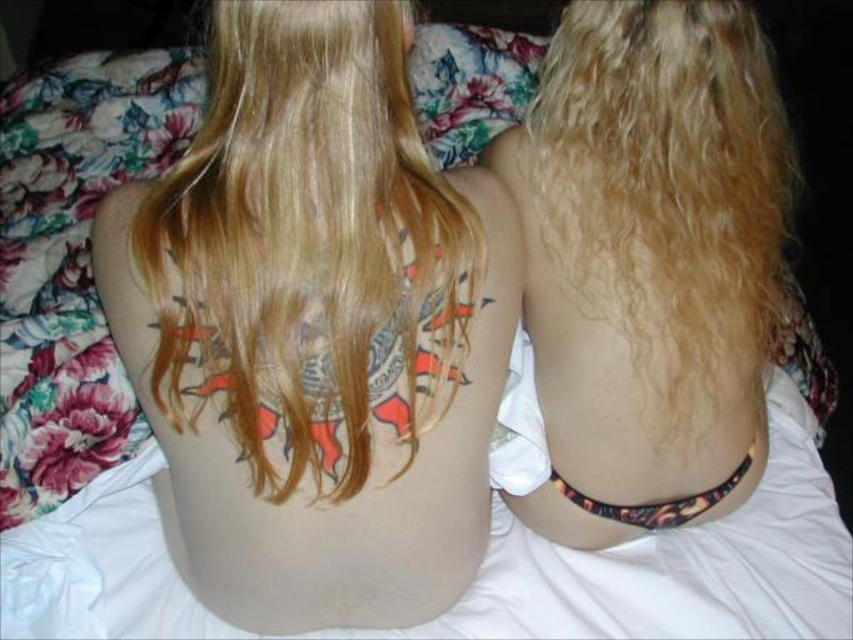
Question: Can you confirm if blonde hair at upper left is positioned to the right of multicolored ink tattoo at lower center?

Choices:
 (A) no
 (B) yes

Answer: (A)

Question: Considering the real-world distances, which object is closest to the multicolored ink tattoo at lower center?

Choices:
 (A) blonde hair at upper left
 (B) curly blonde hair at center

Answer: (B)

Question: Is blonde hair at upper left to the left of multicolored ink tattoo at lower center from the viewer's perspective?

Choices:
 (A) yes
 (B) no

Answer: (A)

Question: Which of these objects is positioned farthest from the blonde hair at upper left?

Choices:
 (A) multicolored ink tattoo at lower center
 (B) curly blonde hair at center

Answer: (A)

Question: Is blonde hair at upper left wider than multicolored ink tattoo at lower center?

Choices:
 (A) no
 (B) yes

Answer: (B)

Question: Which object appears farthest from the camera in this image?

Choices:
 (A) blonde hair at upper left
 (B) curly blonde hair at center
 (C) multicolored ink tattoo at lower center

Answer: (C)